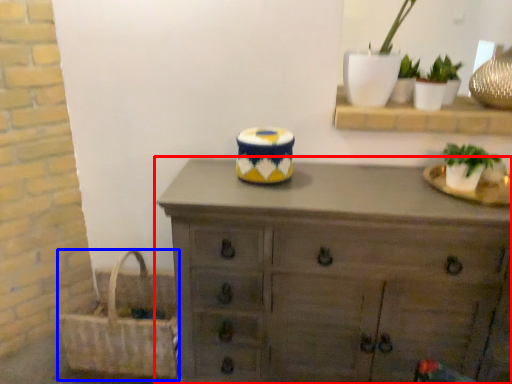
Question: Which object is further to the camera taking this photo, chest of drawers (highlighted by a red box) or picnic basket (highlighted by a blue box)?

Choices:
 (A) chest of drawers
 (B) picnic basket

Answer: (B)